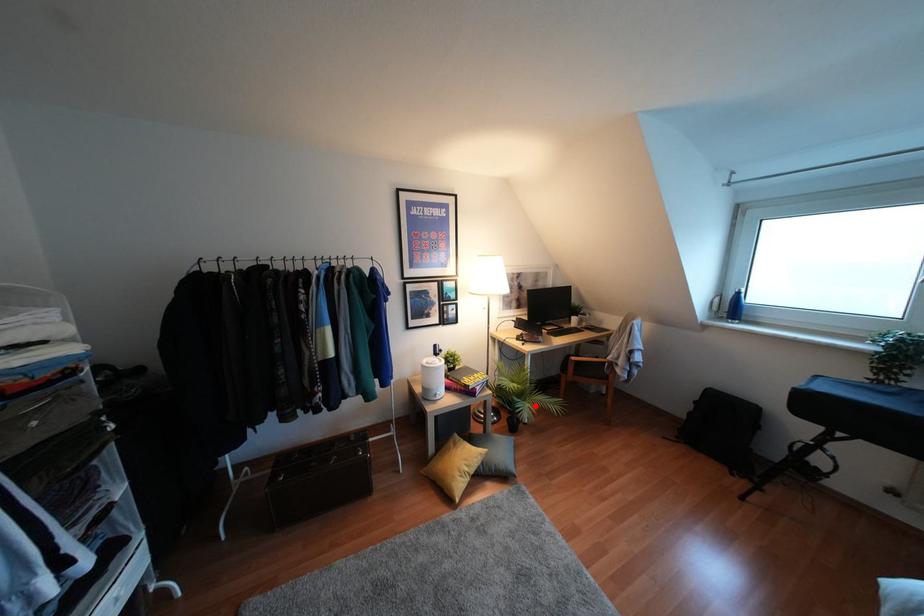
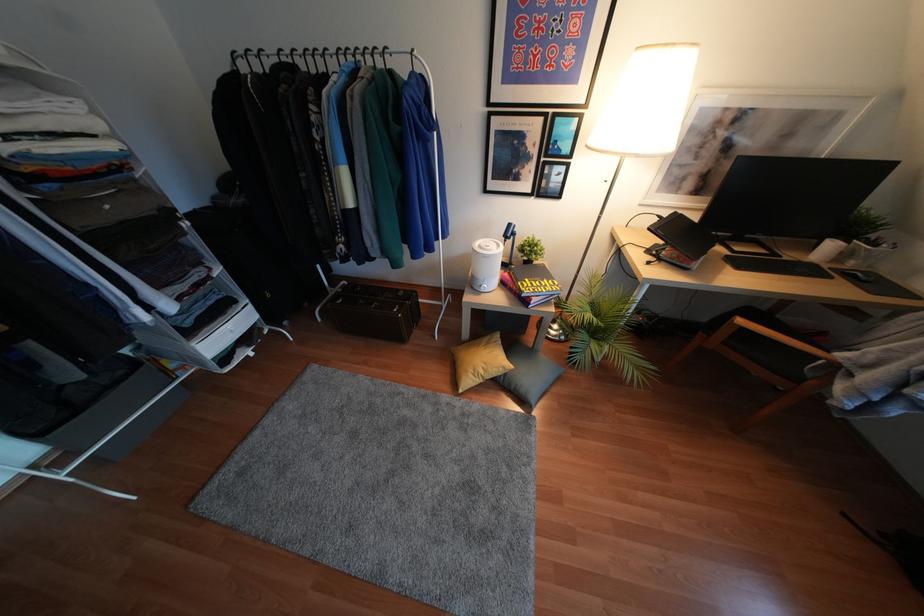
Question: I am providing you with two images of the same scene from different viewpoints. Given a red point in image1, look at the same physical point in image2. Is it:

Choices:
 (A) Closer to the viewpoint
 (B) Farther from the viewpoint

Answer: (A)